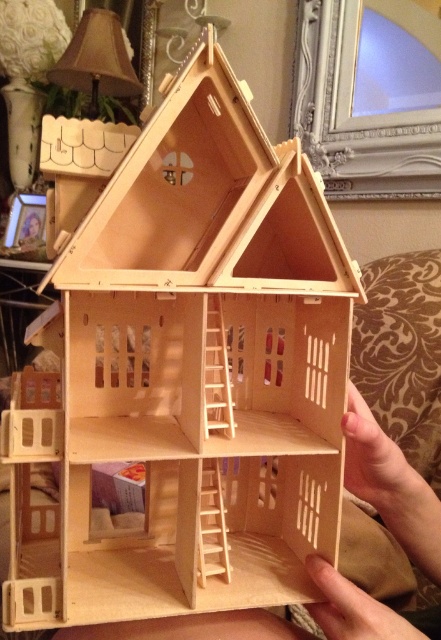
Is natural wood dollhouse at center shorter than beige fabric lampshade at upper left?

Yes, natural wood dollhouse at center is shorter than beige fabric lampshade at upper left.

Is natural wood dollhouse at center to the right of beige fabric lampshade at upper left from the viewer's perspective?

Yes, natural wood dollhouse at center is to the right of beige fabric lampshade at upper left.

This screenshot has width=441, height=640. What do you see at coordinates (392, 486) in the screenshot?
I see `natural wood dollhouse at center` at bounding box center [392, 486].

Identify the location of natural wood dollhouse at center. (392, 486).